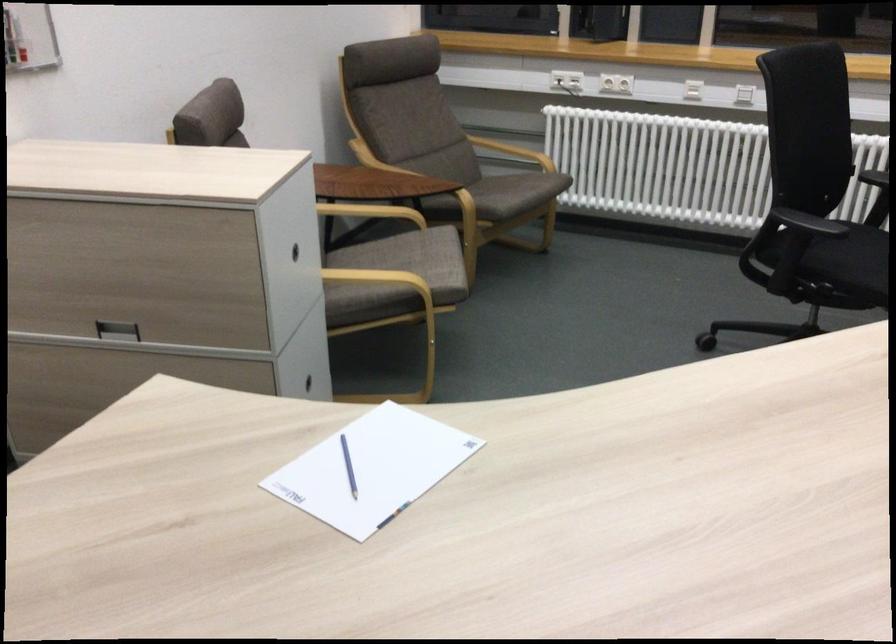
Describe the element at coordinates (807, 223) in the screenshot. The height and width of the screenshot is (644, 896). I see `a black chair armrests` at that location.